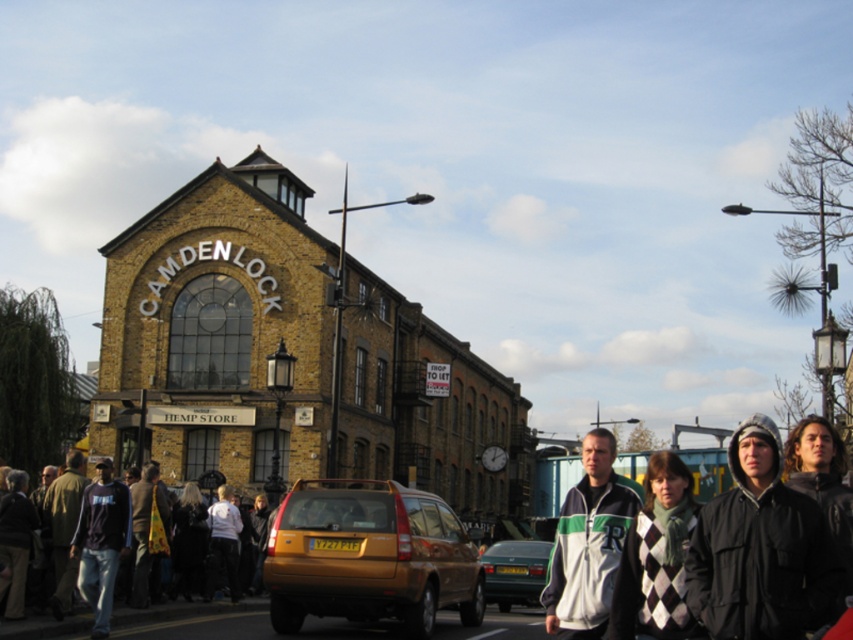
Question: Which object appears closest to the camera in this image?

Choices:
 (A) black cotton hoodie at lower left
 (B) gold matte taxi at center
 (C) green fabric jacket at lower left
 (D) metallic silver car at center

Answer: (A)

Question: Which object appears farthest from the camera in this image?

Choices:
 (A) black cotton hoodie at lower left
 (B) green fabric jacket at lower left

Answer: (B)

Question: Is dark gray jacket at center behind green fabric jacket at lower left?

Choices:
 (A) no
 (B) yes

Answer: (A)

Question: Does white/green striped jacket at center have a lesser width compared to green fabric jacket at lower left?

Choices:
 (A) yes
 (B) no

Answer: (B)

Question: Can you confirm if black cotton hoodie at lower left is positioned to the right of green fabric jacket at lower left?

Choices:
 (A) no
 (B) yes

Answer: (B)

Question: Which of the following is the closest to the observer?

Choices:
 (A) (372, 593)
 (B) (596, 476)

Answer: (B)